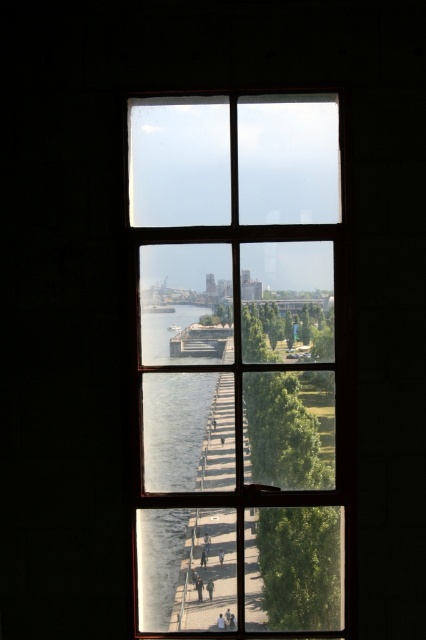
Question: Does wooden window at center appear over clear glass waterway at center?

Choices:
 (A) no
 (B) yes

Answer: (B)

Question: Is wooden window at center positioned behind clear glass waterway at center?

Choices:
 (A) no
 (B) yes

Answer: (A)

Question: Does wooden window at center lie in front of clear glass waterway at center?

Choices:
 (A) yes
 (B) no

Answer: (A)